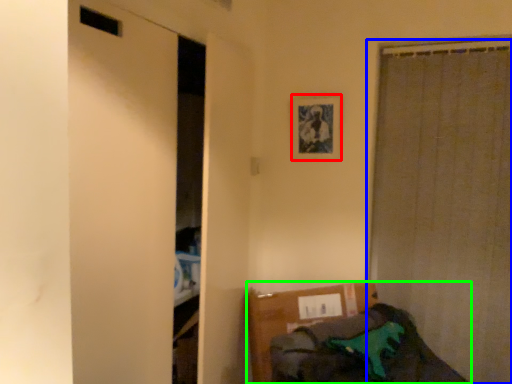
Question: Which object is positioned closest to picture frame (highlighted by a red box)? Select from curtain (highlighted by a blue box) and furniture (highlighted by a green box).

Choices:
 (A) curtain
 (B) furniture

Answer: (A)